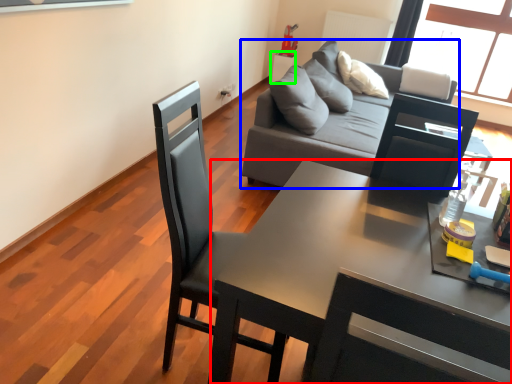
Question: Which object is the farthest from desk (highlighted by a red box)? Choose among these: studio couch (highlighted by a blue box) or side table (highlighted by a green box).

Choices:
 (A) studio couch
 (B) side table

Answer: (B)